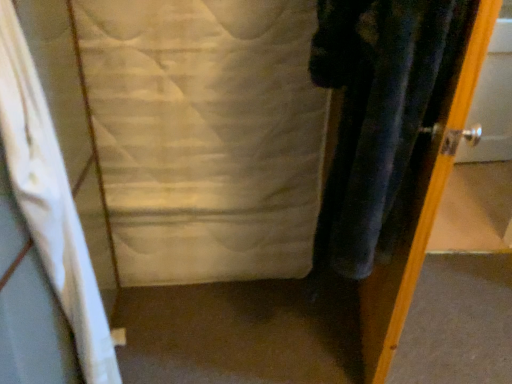
This screenshot has height=384, width=512. What do you see at coordinates (205, 135) in the screenshot? I see `white quilted fabric at center` at bounding box center [205, 135].

Locate an element on the screen. The image size is (512, 384). white fabric curtain at left is located at coordinates (50, 200).

Describe the element at coordinates (50, 200) in the screenshot. I see `white fabric curtain at left` at that location.

Identify the location of white quilted fabric at center. (205, 135).

Is metallic silver door at right situated inside white fabric curtain at left or outside?

metallic silver door at right lies outside white fabric curtain at left.

Is metallic silver door at right directly adjacent to white fabric curtain at left?

No, metallic silver door at right is not next to white fabric curtain at left.

Which of these two, metallic silver door at right or white fabric curtain at left, is wider?

Wider between the two is white fabric curtain at left.

From the image's perspective, is metallic silver door at right located beneath white fabric curtain at left?

No, from the image's perspective, metallic silver door at right is not beneath white fabric curtain at left.

In the scene shown: Can you confirm if white fabric curtain at left is thinner than white quilted fabric at center?

In fact, white fabric curtain at left might be wider than white quilted fabric at center.

Measure the distance from white fabric curtain at left to white quilted fabric at center.

They are 23.04 inches apart.

Is white fabric curtain at left oriented away from white quilted fabric at center?

No, white fabric curtain at left's orientation is not away from white quilted fabric at center.

From the image's perspective, is white fabric curtain at left under white quilted fabric at center?

Yes.

Is white quilted fabric at center turned away from metallic silver door at right?

No, white quilted fabric at center is not facing away from metallic silver door at right.

Which is more to the left, white quilted fabric at center or metallic silver door at right?

From the viewer's perspective, white quilted fabric at center appears more on the left side.

Is white quilted fabric at center inside the boundaries of metallic silver door at right, or outside?

white quilted fabric at center is not enclosed by metallic silver door at right.

Could you tell me if white fabric curtain at left is facing metallic silver door at right?

No, white fabric curtain at left does not turn towards metallic silver door at right.

Considering the positions of point (82, 320) and point (411, 278), is point (82, 320) closer or farther from the camera than point (411, 278)?

Point (82, 320) is positioned closer to the camera compared to point (411, 278).

Considering the positions of objects white fabric curtain at left and metallic silver door at right in the image provided, who is more to the right, white fabric curtain at left or metallic silver door at right?

metallic silver door at right.

Considering the positions of objects white quilted fabric at center and white fabric curtain at left in the image provided, who is more to the right, white quilted fabric at center or white fabric curtain at left?

white quilted fabric at center is more to the right.

From the image's perspective, which one is positioned higher, white quilted fabric at center or white fabric curtain at left?

From the image's view, white quilted fabric at center is above.

The width and height of the screenshot is (512, 384). Find the location of `sheet on the right of white fabric curtain at left`. sheet on the right of white fabric curtain at left is located at coordinates (205, 135).

Considering the sizes of white quilted fabric at center and white fabric curtain at left in the image, is white quilted fabric at center taller or shorter than white fabric curtain at left?

white quilted fabric at center is shorter than white fabric curtain at left.

Locate an element on the screen. This screenshot has width=512, height=384. door in front of the white quilted fabric at center is located at coordinates (422, 193).

Which is farther from the camera, (x=384, y=316) or (x=119, y=128)?

The point (x=119, y=128) is more distant.

Between metallic silver door at right and white quilted fabric at center, which one appears on the right side from the viewer's perspective?

Positioned to the right is metallic silver door at right.

Is metallic silver door at right closer to the viewer compared to white quilted fabric at center?

Yes, metallic silver door at right is closer to the viewer.

Image resolution: width=512 pixels, height=384 pixels. I want to click on curtain in front of the metallic silver door at right, so coord(50,200).

In order to click on sheet that is above the white fabric curtain at left (from the image's perspective) in this screenshot , I will do point(205,135).

In the scene shown: When comparing their distances from white quilted fabric at center, does metallic silver door at right or white fabric curtain at left seem further?

Among the two, metallic silver door at right is located further to white quilted fabric at center.

When comparing their distances from metallic silver door at right, does white quilted fabric at center or white fabric curtain at left seem further?

Among the two, white fabric curtain at left is located further to metallic silver door at right.

Which object lies nearer to the anchor point white fabric curtain at left, metallic silver door at right or white quilted fabric at center?

white quilted fabric at center.

Looking at the image, which one is located further to white quilted fabric at center, white fabric curtain at left or metallic silver door at right?

Among the two, metallic silver door at right is located further to white quilted fabric at center.

When comparing their distances from white fabric curtain at left, does white quilted fabric at center or metallic silver door at right seem closer?

Based on the image, white quilted fabric at center appears to be nearer to white fabric curtain at left.

Considering their positions, is white fabric curtain at left positioned closer to metallic silver door at right than white quilted fabric at center?

white quilted fabric at center is positioned closer to the anchor metallic silver door at right.

What are the coordinates of `sheet situated between white fabric curtain at left and metallic silver door at right from left to right` in the screenshot? It's located at (205, 135).